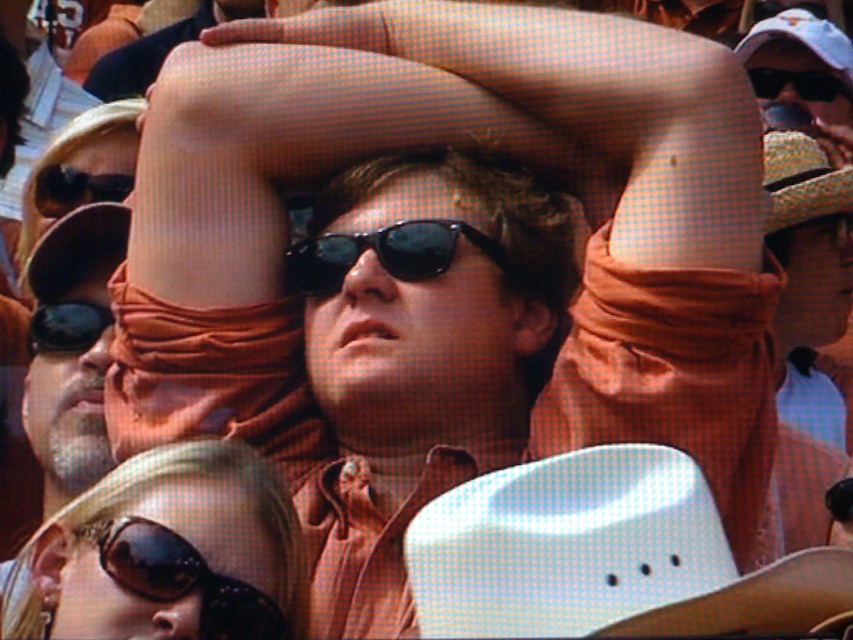
Question: Considering the relative positions of straw textured cowboy hat at upper center and black plastic sunglasses at upper left in the image provided, where is straw textured cowboy hat at upper center located with respect to black plastic sunglasses at upper left?

Choices:
 (A) left
 (B) right

Answer: (B)

Question: Does matte brown shirt at center have a lesser width compared to black plastic sunglasses at upper center?

Choices:
 (A) no
 (B) yes

Answer: (B)

Question: Based on their relative distances, which object is nearer to the black textured sunglasses at lower left?

Choices:
 (A) sunglasses at lower left
 (B) black plastic sunglasses at center
 (C) black plastic sunglasses at upper left

Answer: (A)

Question: Which point is farther from the camera taking this photo?

Choices:
 (A) (51, 547)
 (B) (283, 262)
 (C) (807, 97)

Answer: (C)

Question: Estimate the real-world distances between objects in this image. Which object is farther from the straw textured cowboy hat at upper center?

Choices:
 (A) black plastic sunglasses at upper left
 (B) sunglasses at lower left
 (C) black plastic sunglasses at center

Answer: (B)

Question: Does sunglasses at lower left appear on the left side of black plastic sunglasses at upper center?

Choices:
 (A) no
 (B) yes

Answer: (B)